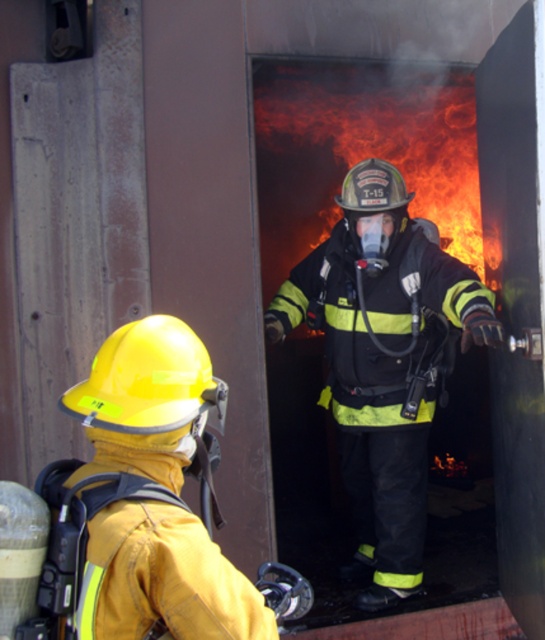
Is black matte fireman at center bigger than yellow matte helmet at left?

Yes.

Does point (365, 509) come closer to viewer compared to point (153, 355)?

No, (365, 509) is behind (153, 355).

Locate an element on the screen. black matte fireman at center is located at coordinates (384, 362).